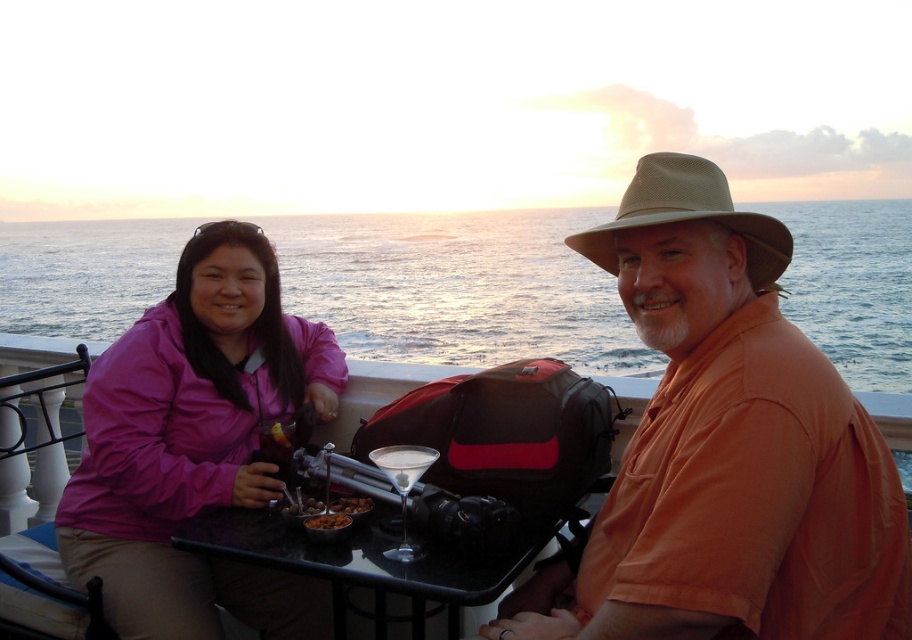
Between point (342, 497) and point (334, 518), which one is positioned in front?

Point (334, 518) is in front.

Can you confirm if shiny metallic bowl at table center is positioned to the right of crumbly brown bread at table center?

No, shiny metallic bowl at table center is not to the right of crumbly brown bread at table center.

Locate an element on the screen. The image size is (912, 640). shiny metallic bowl at table center is located at coordinates (330, 506).

This screenshot has width=912, height=640. What do you see at coordinates (195, 445) in the screenshot? I see `pink fabric jacket at left` at bounding box center [195, 445].

The image size is (912, 640). I want to click on pink fabric jacket at left, so click(x=195, y=445).

Does pink fabric jacket at left have a lesser height compared to beige mesh cowboy hat at upper right?

Incorrect, pink fabric jacket at left's height does not fall short of beige mesh cowboy hat at upper right's.

Based on the photo, can you confirm if pink fabric jacket at left is wider than beige mesh cowboy hat at upper right?

Yes, pink fabric jacket at left is wider than beige mesh cowboy hat at upper right.

Which is behind, point (123, 394) or point (688, 205)?

Positioned behind is point (123, 394).

The width and height of the screenshot is (912, 640). Identify the location of pink fabric jacket at left. (195, 445).